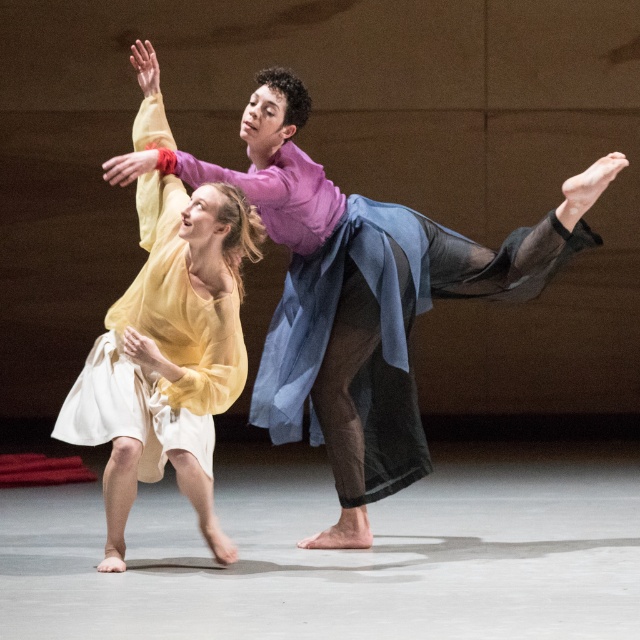
What is located at the coordinates point (x=360, y=296)?

The point (x=360, y=296) is occupied by the matte yellow dress at center.

You are standing in the front row of the theater watching the dance performance. The stage is 6 meters deep. If you want to reach the matte yellow dress at center, can you physically touch it from your current position?

The matte yellow dress at center is 5.75 meters away from viewer. Since the stage is 6 meters deep, you are just within reach of touching it if you extend your arm fully.

You are a photographer in the audience and want to capture a clear photo of both the matte yellow dress at center and the matte yellow dress at left. Which one will appear larger in the photo?

The matte yellow dress at center will appear larger in the photo because it is closer to the viewer than the matte yellow dress at left.